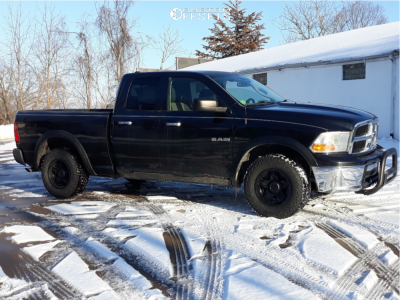
At what (x,y) coordinates should I click in order to perform the action: click on front door handle. Please return your answer as a coordinate pair (x, y). Looking at the image, I should click on (176, 128).